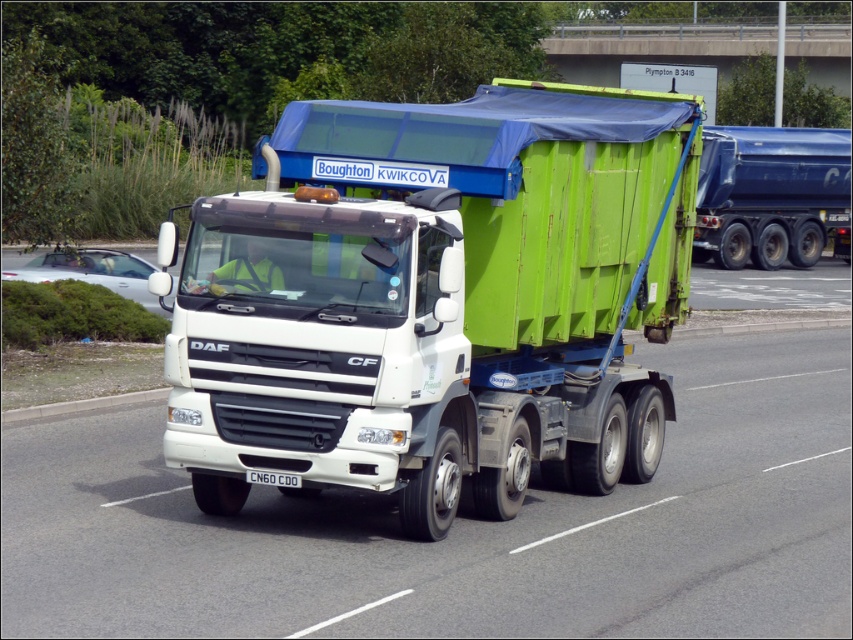
You are a traffic officer observing a road with a green matte trailer truck at center and a blue metallic trailer at right. Which trailer is positioned lower on the road?

The green matte trailer truck at center is positioned lower than the blue metallic trailer at right.

You are a delivery driver who needs to pass under a bridge that has a height restriction of 4 meters. You are currently driving the white DAF CF truck with the blue metallic trailer at right and the white plastic license plate at center. Based on the scene, can you safely pass under the bridge without hitting the trailer?

The blue metallic trailer at right is much taller than the white plastic license plate at center. Since the license plate is at center, its height is likely below the trailer, but the trailer being taller may exceed the 4 meters height limit. You should check the trailer height before proceeding.

You are a traffic officer observing a vehicle on a multi lane road. The vehicle has a green matte trailer truck at center and a white plastic license plate at center. Which object is wider?

The green matte trailer truck at center is wider than the white plastic license plate at center.